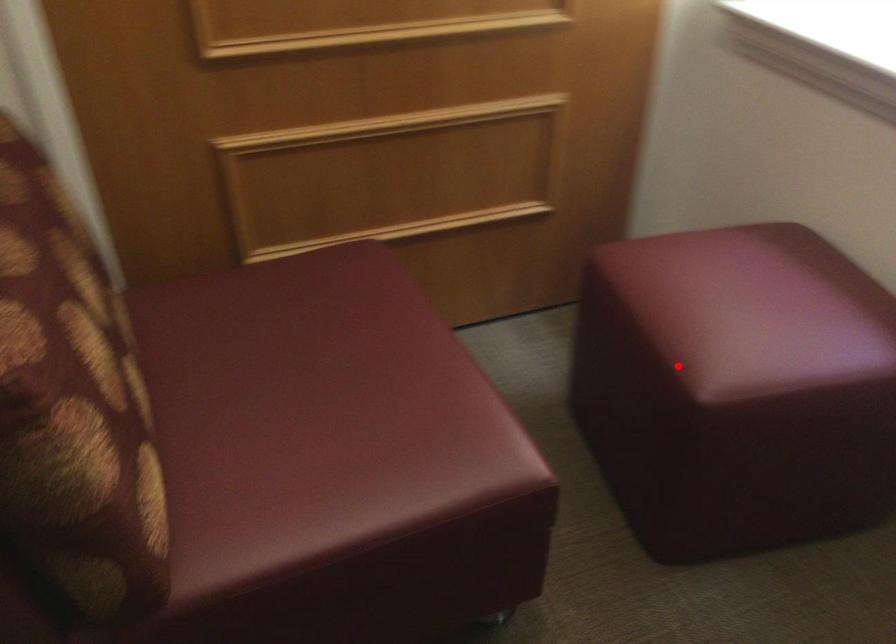
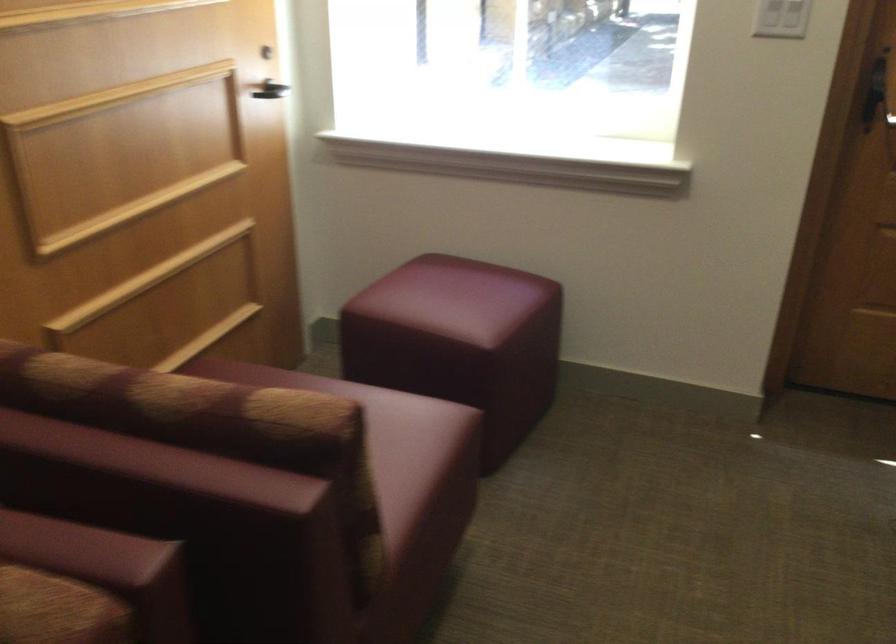
Question: I am providing you with two images of the same scene from different viewpoints. Image1 has a red point marked. In image2, the corresponding 3D location appears at what relative position? Reply with the corresponding letter.

Choices:
 (A) Closer
 (B) Farther

Answer: (B)